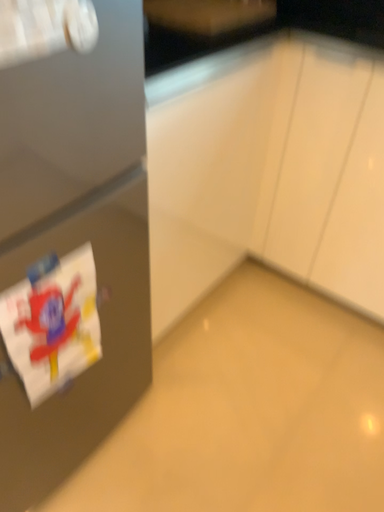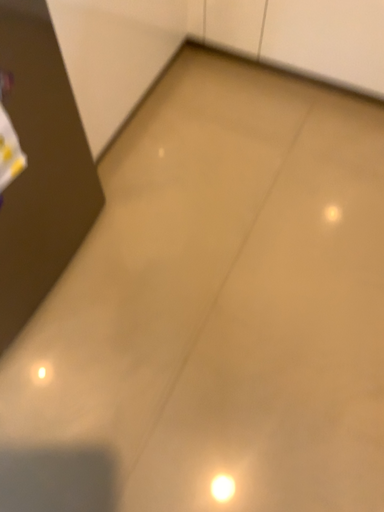
Question: Which way did the camera rotate in the video?

Choices:
 (A) rotated left
 (B) rotated right

Answer: (B)